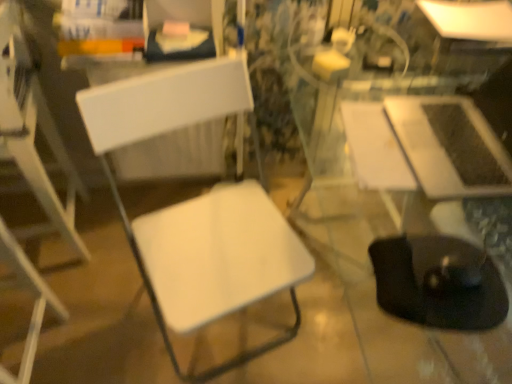
Find the location of `free space to the left of white matte chair at left, the 2th chair from the left`. free space to the left of white matte chair at left, the 2th chair from the left is located at coordinates (114, 308).